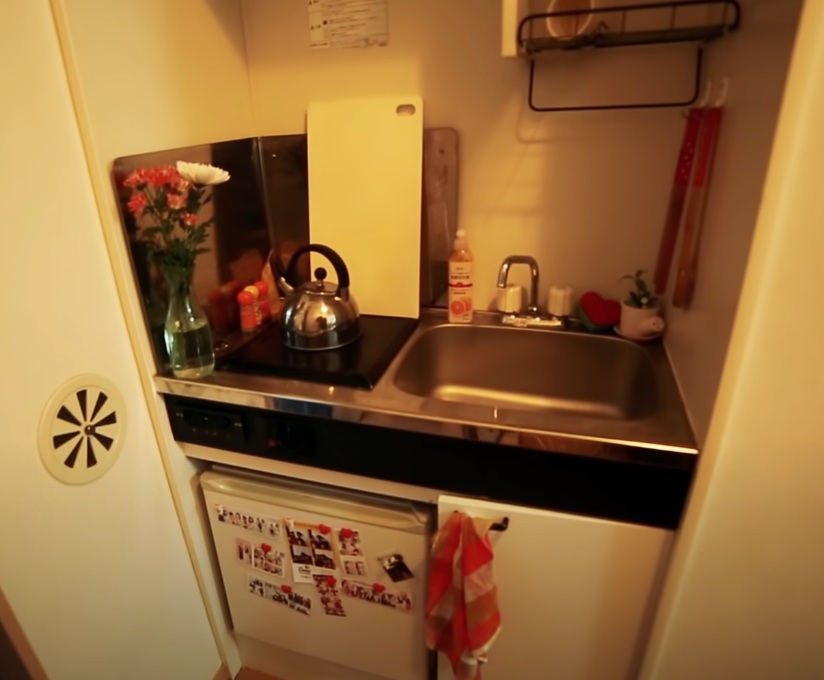
Locate an element on the screen. faucet is located at coordinates (518, 262).